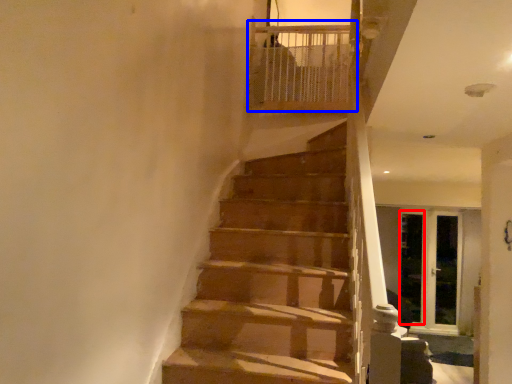
Question: Which point is closer to the camera, screen door (highlighted by a red box) or balustrade (highlighted by a blue box)?

Choices:
 (A) screen door
 (B) balustrade

Answer: (B)